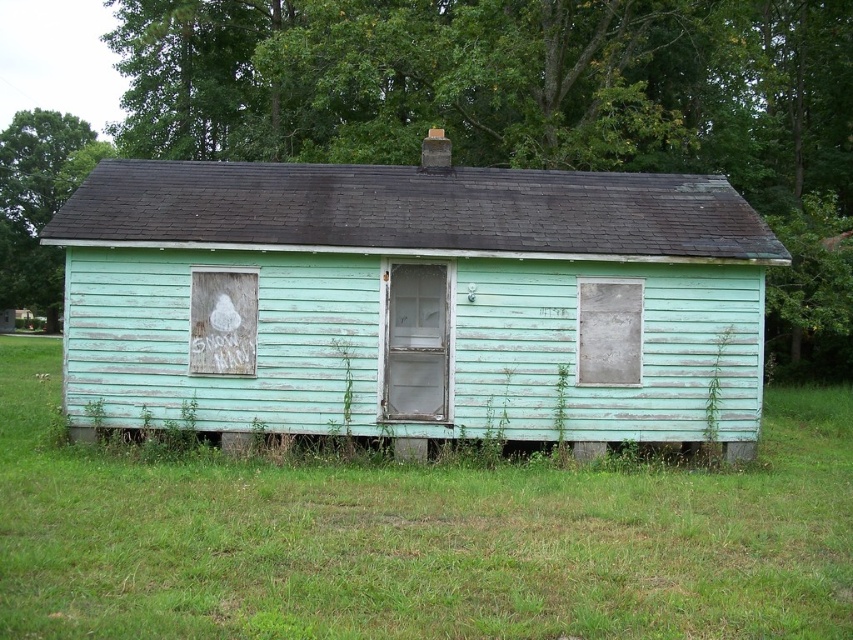
You are standing at the origin point of the coordinate system. You want to move to the light green wood hut at center. What are the coordinates you need to move to?

The coordinates you need to move to are approximately 0.459 on the x axis and 0.451 on the y axis, as the light green wood hut at center is located at point (384,292).

You are standing at the origin point of the image coordinate system. Which object is located at the coordinate point (x=384, y=292)?

The light green wood hut at center is located at the coordinate point (x=384, y=292).

You are planning to place a new garden bench in front of the light green wood hut at center and the white chalkboard at left. Which object requires a wider space for placement due to its size?

The light green wood hut at center requires a wider space for placement because its width surpasses that of the white chalkboard at left.